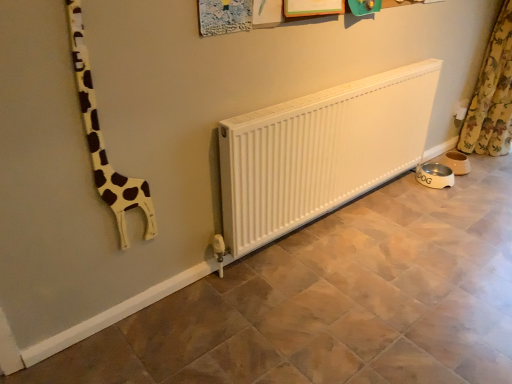
Question: Is floral fabric curtain at right taller or shorter than white matte giraffe at left?

Choices:
 (A) tall
 (B) short

Answer: (A)

Question: Is floral fabric curtain at right bigger or smaller than white matte giraffe at left?

Choices:
 (A) small
 (B) big

Answer: (B)

Question: In terms of width, does floral fabric curtain at right look wider or thinner when compared to white matte giraffe at left?

Choices:
 (A) thin
 (B) wide

Answer: (B)

Question: Considering the positions of point (140, 195) and point (505, 89), is point (140, 195) closer or farther from the camera than point (505, 89)?

Choices:
 (A) farther
 (B) closer

Answer: (B)

Question: Is white matte giraffe at left in front of or behind floral fabric curtain at right in the image?

Choices:
 (A) front
 (B) behind

Answer: (A)

Question: Based on their sizes in the image, would you say white matte giraffe at left is bigger or smaller than floral fabric curtain at right?

Choices:
 (A) small
 (B) big

Answer: (A)

Question: From a real-world perspective, relative to floral fabric curtain at right, is white matte giraffe at left vertically above or below?

Choices:
 (A) below
 (B) above

Answer: (B)